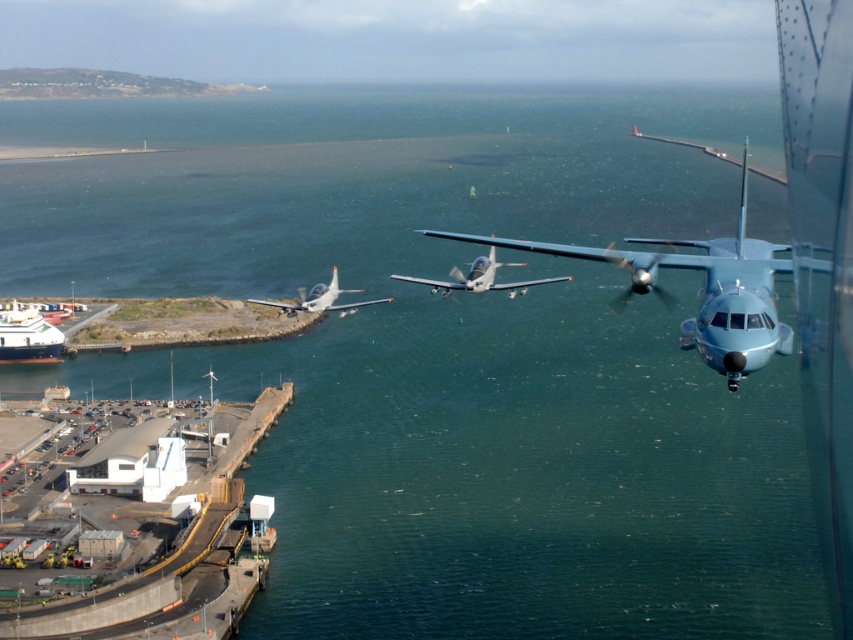
You are a pilot preparing to land your plane on the runway near the white glossy ship at lower left and the silver metallic airplane at center. Which object is closer to the landing zone?

The white glossy ship at lower left is closer to the landing zone because it is positioned under the silver metallic airplane at center, indicating it is nearer in the scene.

You are a pilot preparing to land your small plane on the runway near the white concrete dock at lower left and the white glossy ship at lower left. Which object will your plane pass over first as you approach the runway?

The white concrete dock at lower left will be passed over first because it is closer to the runway than the white glossy ship at lower left, which is further away.